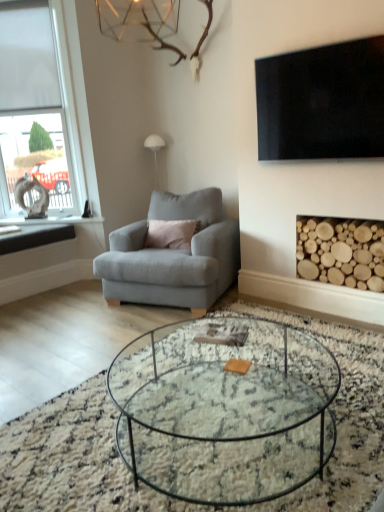
Question: Relative to white frosted glass window at left, is clear glass coffee table at center in front or behind?

Choices:
 (A) behind
 (B) front

Answer: (B)

Question: From the image's perspective, is clear glass coffee table at center positioned above or below white frosted glass window at left?

Choices:
 (A) below
 (B) above

Answer: (A)

Question: Considering the real-world distances, which object is farthest from the black stone window sill at left?

Choices:
 (A) wooden logs at lower right
 (B) matte gray armchair at center
 (C) clear glass coffee table at center
 (D) black glossy tv at upper right
 (E) white frosted glass window at left

Answer: (C)

Question: Based on their relative distances, which object is farther from the wooden logs at lower right?

Choices:
 (A) black stone window sill at left
 (B) white frosted glass window at left
 (C) clear glass coffee table at center
 (D) black glossy tv at upper right
 (E) matte gray armchair at center

Answer: (B)